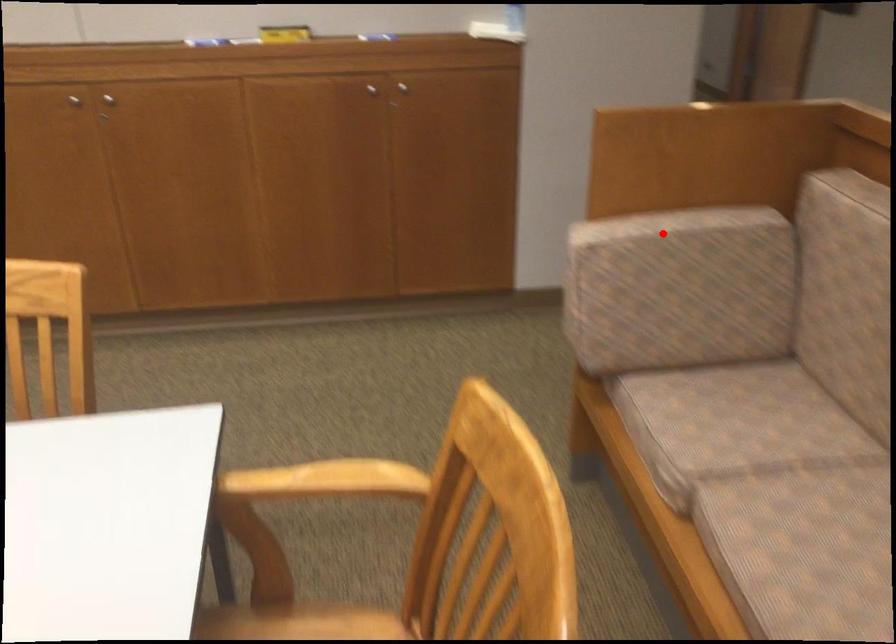
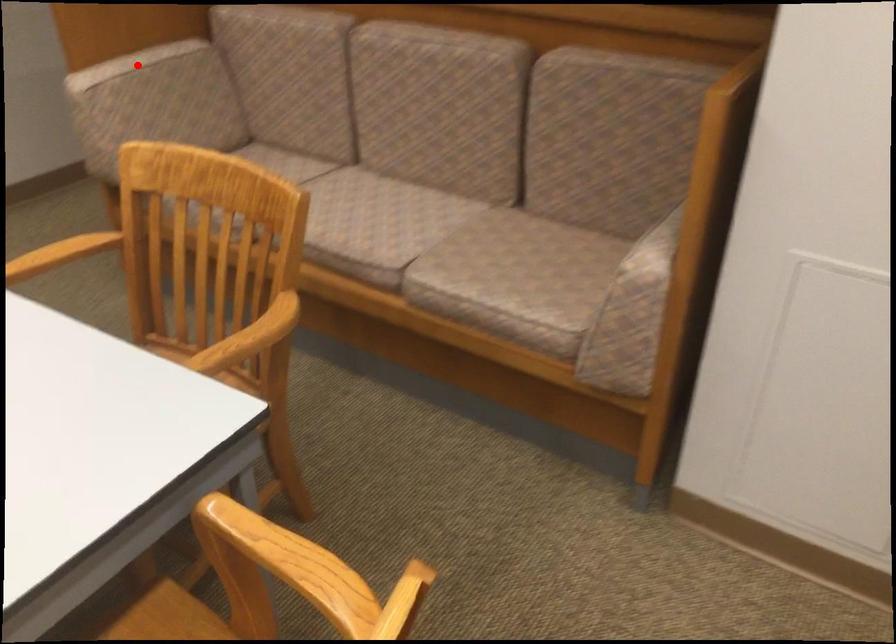
I am providing you with two images of the same scene from different viewpoints. A red point is marked on the first image and another point is marked on the second image. Is the red point in image1 aligned with the point shown in image2?

Yes